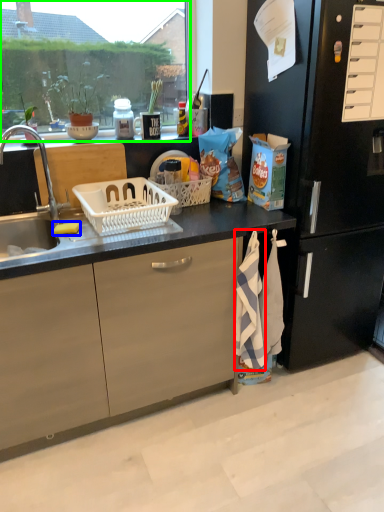
Question: Based on their relative distances, which object is nearer to beach towel (highlighted by a red box)? Choose from food (highlighted by a blue box) and window screen (highlighted by a green box).

Choices:
 (A) food
 (B) window screen

Answer: (A)